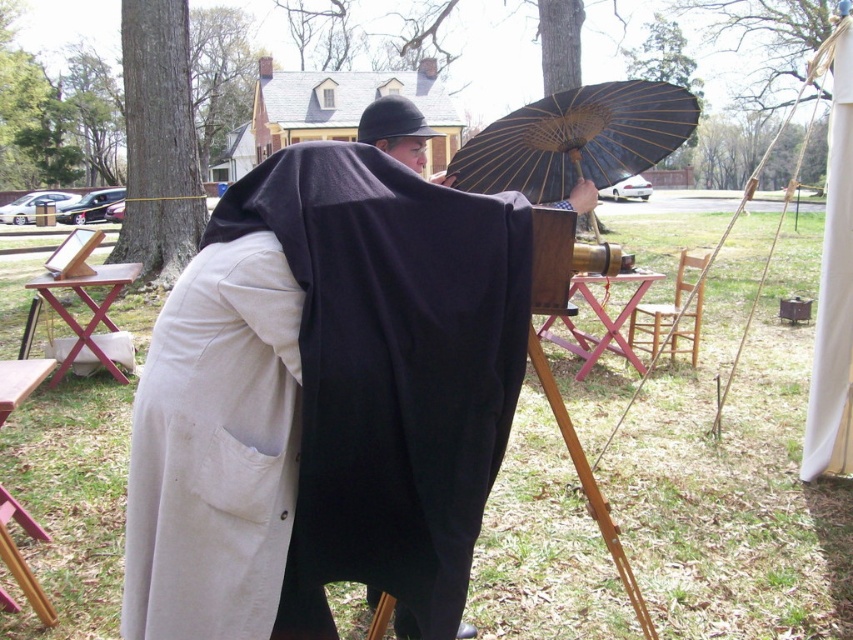
Question: Estimate the real-world distances between objects in this image. Which object is farther from the brown wood picnic table at left?

Choices:
 (A) pink wood picnic table at center
 (B) black paper umbrella at upper center

Answer: (B)

Question: Which of the following is the closest to the observer?

Choices:
 (A) pink wood picnic table at center
 (B) white cotton robe at center
 (C) wooden picnic table at lower left

Answer: (B)

Question: Does black paper umbrella at upper center lie in front of brown wood picnic table at left?

Choices:
 (A) yes
 (B) no

Answer: (A)

Question: Estimate the real-world distances between objects in this image. Which object is closer to the pink wood picnic table at center?

Choices:
 (A) black paper umbrella at upper center
 (B) white cotton robe at center

Answer: (A)

Question: Does white cotton robe at center appear on the left side of pink wood picnic table at center?

Choices:
 (A) no
 (B) yes

Answer: (B)

Question: Considering the relative positions of black paper umbrella at upper center and pink wood picnic table at center in the image provided, where is black paper umbrella at upper center located with respect to pink wood picnic table at center?

Choices:
 (A) below
 (B) above

Answer: (B)